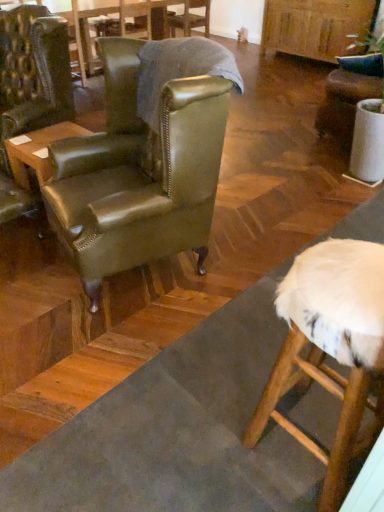
Question: Considering the positions of wooden table at left, marked as the first table in a bottom-to-top arrangement, and green leather table at upper left, which appears as the 2th table when viewed from the front, in the image, is wooden table at left, marked as the first table in a bottom-to-top arrangement, wider or thinner than green leather table at upper left, which appears as the 2th table when viewed from the front,?

Choices:
 (A) thin
 (B) wide

Answer: (A)

Question: Considering the positions of point coord(41,230) and point coord(87,34), is point coord(41,230) closer or farther from the camera than point coord(87,34)?

Choices:
 (A) closer
 (B) farther

Answer: (A)

Question: Which object is the closest to the green leather wingback chair at center, acting as the second chair starting from the left?

Choices:
 (A) white fur-covered stool at lower right
 (B) green leather table at upper left, the 1th table when ordered from back to front
 (C) wooden table at left, acting as the 2th table starting from the back
 (D) leather wingback chair at center, marked as the 3th chair in a front-to-back arrangement
 (E) leather wingback chair at upper center, which is counted as the third chair, starting from the left

Answer: (C)

Question: Which object is positioned closest to the green leather wingback chair at center, acting as the second chair starting from the left?

Choices:
 (A) white fur-covered stool at lower right
 (B) green leather table at upper left, the 1th table positioned from the top
 (C) leather green wingback chair at left, which appears as the 1th chair when viewed from the left
 (D) wooden table at left, which is the first table from front to back
 (E) leather wingback chair at upper center, acting as the 2th chair starting from the right

Answer: (D)